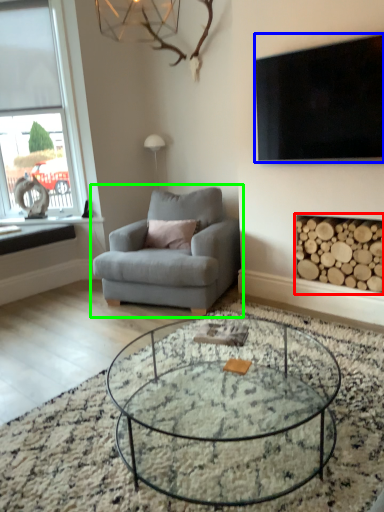
Question: Considering the real-world distances, which object is farthest from fireplace (highlighted by a red box)? television (highlighted by a blue box) or chair (highlighted by a green box)?

Choices:
 (A) television
 (B) chair

Answer: (B)